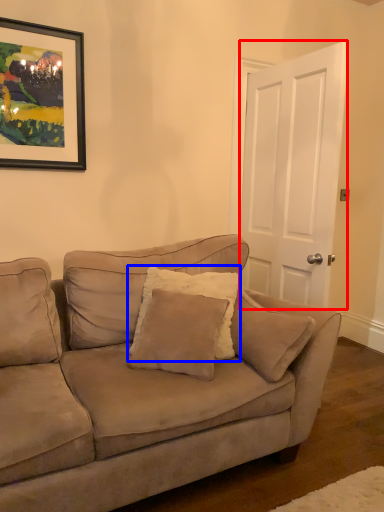
Question: Which point is closer to the camera, door (highlighted by a red box) or pillow (highlighted by a blue box)?

Choices:
 (A) door
 (B) pillow

Answer: (B)